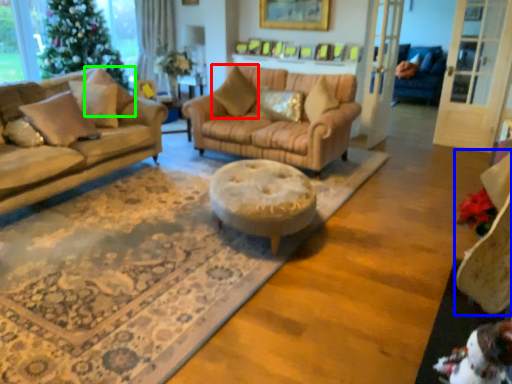
Question: Which object is positioned closest to pillow (highlighted by a red box)? Select from swivel chair (highlighted by a blue box) and pillow (highlighted by a green box).

Choices:
 (A) swivel chair
 (B) pillow

Answer: (B)